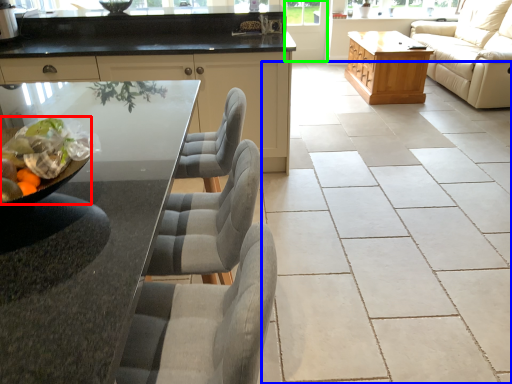
Question: Which object is positioned farthest from food (highlighted by a red box)? Select from ceramic tile (highlighted by a blue box) and screen door (highlighted by a green box).

Choices:
 (A) ceramic tile
 (B) screen door

Answer: (B)